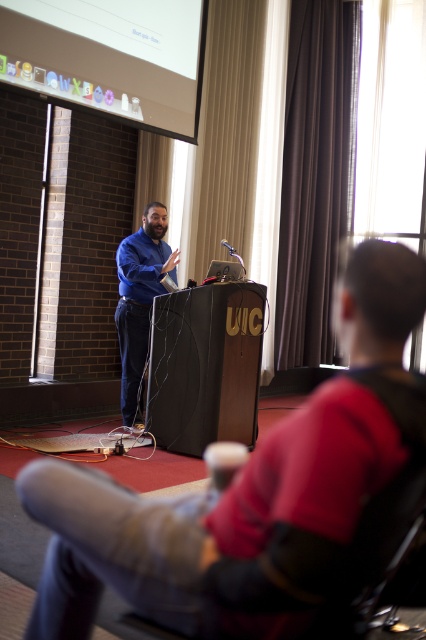
Question: Can you confirm if white glossy projector screen at upper center is bigger than black matte podium at center?

Choices:
 (A) no
 (B) yes

Answer: (B)

Question: Can you confirm if black matte podium at center is positioned to the left of blue smooth shirt at center?

Choices:
 (A) no
 (B) yes

Answer: (A)

Question: Which point is closer to the camera?

Choices:
 (A) (74, 93)
 (B) (219, 385)
 (C) (296, 627)

Answer: (C)

Question: Which point is farther to the camera?

Choices:
 (A) pyautogui.click(x=154, y=8)
 (B) pyautogui.click(x=176, y=352)

Answer: (A)

Question: Among these points, which one is nearest to the camera?

Choices:
 (A) (135, 250)
 (B) (31, 60)
 (C) (382, 484)

Answer: (C)

Question: Can you confirm if blue shirt at center is smaller than white glossy projector screen at upper center?

Choices:
 (A) yes
 (B) no

Answer: (A)